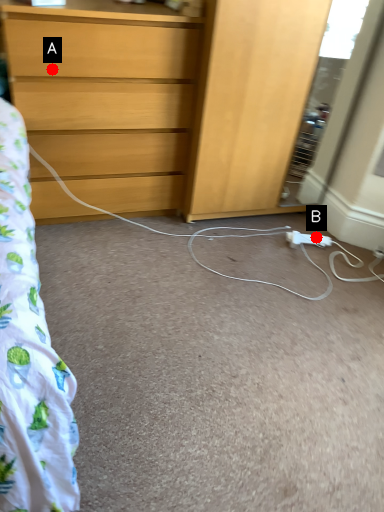
Question: Two points are circled on the image, labeled by A and B beside each circle. Which of the following is the farthest from the observer?

Choices:
 (A) A is further
 (B) B is further

Answer: (B)